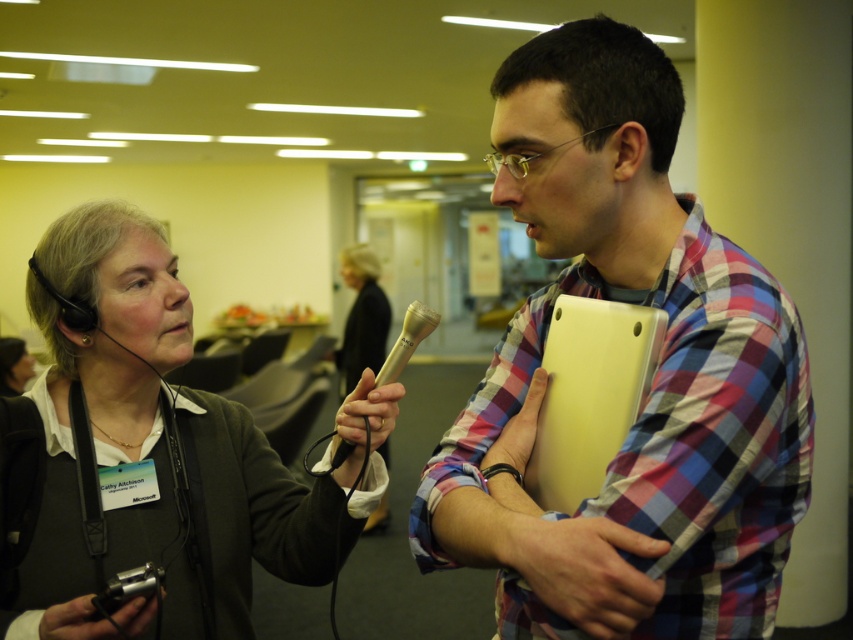
Who is more distant from viewer, [20,625] or [346,346]?

Point [346,346]

Does matte black headset at left have a greater width compared to matte black microphone at center?

Yes, matte black headset at left is wider than matte black microphone at center.

Is point (218, 592) in front of point (366, 305)?

Yes, it is in front of point (366, 305).

Image resolution: width=853 pixels, height=640 pixels. I want to click on matte black headset at left, so click(x=149, y=456).

Looking at this image, is matte yellow laptop at center smaller than matte black microphone at center?

Correct, matte yellow laptop at center occupies less space than matte black microphone at center.

I want to click on matte yellow laptop at center, so click(x=653, y=381).

Does matte yellow laptop at center appear on the left side of matte black headset at left?

Incorrect, matte yellow laptop at center is not on the left side of matte black headset at left.

Looking at this image, which is above, matte yellow laptop at center or matte black headset at left?

matte yellow laptop at center is above.

This screenshot has height=640, width=853. What are the coordinates of `matte yellow laptop at center` in the screenshot? It's located at (653, 381).